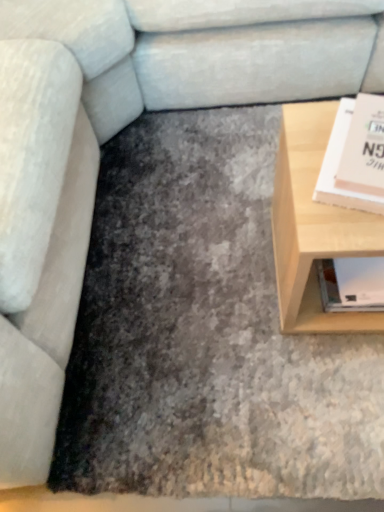
Question: Is light wood table at right wider or thinner than matte pink paperback book at right?

Choices:
 (A) thin
 (B) wide

Answer: (B)

Question: From the image's perspective, is light wood table at right above or below matte pink paperback book at right?

Choices:
 (A) above
 (B) below

Answer: (B)

Question: In the image, is light wood table at right positioned in front of or behind matte pink paperback book at right?

Choices:
 (A) behind
 (B) front

Answer: (A)

Question: Is matte pink paperback book at right inside or outside of light wood table at right?

Choices:
 (A) outside
 (B) inside

Answer: (A)

Question: From the image's perspective, relative to light wood table at right, is matte pink paperback book at right above or below?

Choices:
 (A) above
 (B) below

Answer: (A)

Question: Considering the positions of matte pink paperback book at right and light wood table at right in the image, is matte pink paperback book at right bigger or smaller than light wood table at right?

Choices:
 (A) small
 (B) big

Answer: (A)

Question: In the image, is matte pink paperback book at right positioned in front of or behind light wood table at right?

Choices:
 (A) behind
 (B) front

Answer: (B)